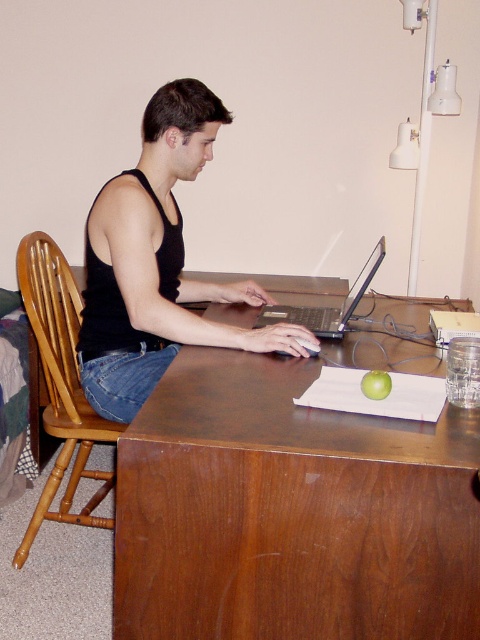
Question: Does black matte tank top at center come in front of green matte apple at center?

Choices:
 (A) yes
 (B) no

Answer: (B)

Question: Estimate the real-world distances between objects in this image. Which object is farther from the satin silver laptop at center?

Choices:
 (A) green matte apple at center
 (B) black matte tank top at center

Answer: (A)

Question: Observing the image, what is the correct spatial positioning of black matte tank top at center in reference to satin silver laptop at center?

Choices:
 (A) right
 (B) left

Answer: (B)

Question: Among these objects, which one is farthest from the camera?

Choices:
 (A) brown wood table at center
 (B) black matte tank top at center
 (C) green matte apple at center
 (D) satin silver laptop at center

Answer: (B)

Question: Does black matte tank top at center appear on the left side of satin silver laptop at center?

Choices:
 (A) no
 (B) yes

Answer: (B)

Question: Which object is farther from the camera taking this photo?

Choices:
 (A) brown wood table at center
 (B) black matte tank top at center
 (C) satin silver laptop at center
 (D) green matte apple at center

Answer: (B)